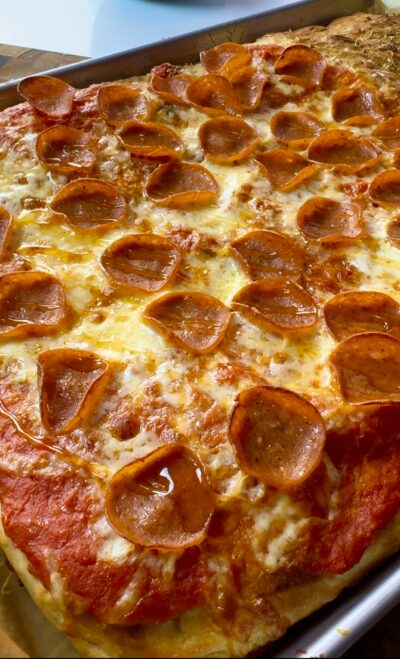
At what (x,y) coordinates should I click in order to perform the action: click on table. Please return your answer as a coordinate pair (x, y). This screenshot has width=400, height=659. Looking at the image, I should click on (11, 59).